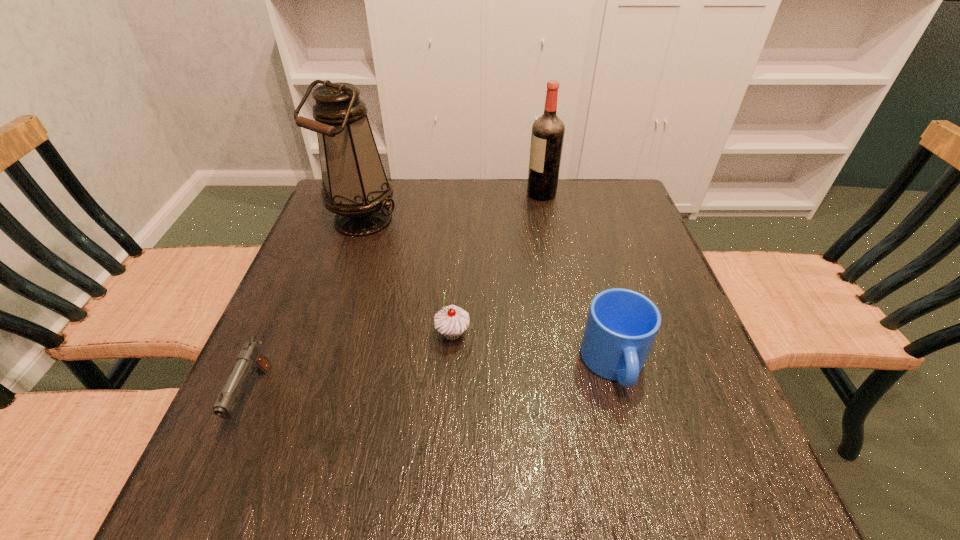
Locate an element on the screen. The width and height of the screenshot is (960, 540). oil lamp is located at coordinates (355, 187).

Locate an element on the screen. liquor is located at coordinates (547, 137).

The width and height of the screenshot is (960, 540). I want to click on mug, so click(622, 324).

Locate an element on the screen. This screenshot has width=960, height=540. the third object from right to left is located at coordinates (451, 321).

At what (x,y) coordinates should I click in order to perform the action: click on the shortest object. Please return your answer as a coordinate pair (x, y). The width and height of the screenshot is (960, 540). Looking at the image, I should click on (250, 359).

Where is `free point located on the right of the oil lamp`? The height and width of the screenshot is (540, 960). free point located on the right of the oil lamp is located at coordinates (536, 220).

You are a GUI agent. You are given a task and a screenshot of the screen. Output one action in this format:
    pyautogui.click(x=<x>, y=<y>)
    Task: Click on the free space located 0.240m on the front-facing side of the liquor
    
    Given the screenshot: What is the action you would take?
    pyautogui.click(x=445, y=194)

Locate an element on the screen. This screenshot has width=960, height=540. vacant space located on the front-facing side of the liquor is located at coordinates (452, 194).

Identify the location of free space located on the front-facing side of the liquor. (439, 194).

This screenshot has height=540, width=960. I want to click on vacant space located 0.170m on the side of the mug with the handle, so click(x=652, y=504).